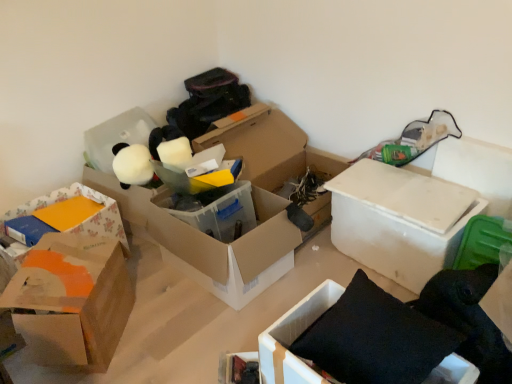
The height and width of the screenshot is (384, 512). Find the location of `white cardboard box at center-right, the fifth box when ordered from left to right`. white cardboard box at center-right, the fifth box when ordered from left to right is located at coordinates (399, 220).

Measure the distance between point (120,139) and camera.

Point (120,139) and camera are 2.33 meters apart from each other.

Image resolution: width=512 pixels, height=384 pixels. Find the location of `orange cardboard box at left, the second box in the left-to-right sequence`. orange cardboard box at left, the second box in the left-to-right sequence is located at coordinates (71, 300).

Image resolution: width=512 pixels, height=384 pixels. I want to click on white cardboard box at center-right, the first box in the right-to-left sequence, so click(x=399, y=220).

From the image's perspective, which is below, translucent plastic box at center, placed as the third box when sorted from left to right, or matte black book at lower center, the first storage box ordered from the bottom?

matte black book at lower center, the first storage box ordered from the bottom, from the image's perspective.

Is point (208, 245) farther from viewer compared to point (224, 371)?

Yes, it is behind point (224, 371).

Can you confirm if translucent plastic box at center, placed as the 3th box when sorted from right to left, is bigger than matte black book at lower center, the 2th storage box from the top?

Indeed, translucent plastic box at center, placed as the 3th box when sorted from right to left, has a larger size compared to matte black book at lower center, the 2th storage box from the top.

Is matte black book at lower center, arranged as the second storage box when viewed from the left, located within translucent plastic box at center, placed as the 3th box when sorted from right to left?

No, matte black book at lower center, arranged as the second storage box when viewed from the left, is not inside translucent plastic box at center, placed as the 3th box when sorted from right to left.

Considering the sizes of objects floral paper box at left, which is the first box in left-to-right order, and white cardboard box at center-right, the first box in the right-to-left sequence, in the image provided, who is shorter, floral paper box at left, which is the first box in left-to-right order, or white cardboard box at center-right, the first box in the right-to-left sequence,?

With less height is floral paper box at left, which is the first box in left-to-right order.

Is floral paper box at left, which is the first box in left-to-right order, looking in the opposite direction of white cardboard box at center-right, the first box in the right-to-left sequence?

floral paper box at left, which is the first box in left-to-right order, does not have its back to white cardboard box at center-right, the first box in the right-to-left sequence.

Which object is further away from the camera taking this photo, floral paper box at left, which is the first box in left-to-right order, or white cardboard box at center-right, the fifth box when ordered from left to right?

floral paper box at left, which is the first box in left-to-right order.

From a real-world perspective, between floral paper box at left, marked as the 5th box in a right-to-left arrangement, and white cardboard box at center-right, the fifth box when ordered from left to right, who is vertically higher?

In real-world perspective, floral paper box at left, marked as the 5th box in a right-to-left arrangement, is above.

In the image, is white matte stuffed animal at upper left, the 1th storage box viewed from the top, on the left side or the right side of orange cardboard box at left, the second box in the left-to-right sequence?

Clearly, white matte stuffed animal at upper left, the 1th storage box viewed from the top, is on the left of orange cardboard box at left, the second box in the left-to-right sequence, in the image.

The height and width of the screenshot is (384, 512). In order to click on storage box above the orange cardboard box at left, which appears as the 4th box when viewed from the right (from a real-world perspective) in this screenshot , I will do `click(116, 137)`.

From the image's perspective, who appears lower, white matte stuffed animal at upper left, arranged as the 2th storage box when viewed from the right, or orange cardboard box at left, the second box in the left-to-right sequence?

orange cardboard box at left, the second box in the left-to-right sequence, is shown below in the image.

In the scene shown: Is white matte stuffed animal at upper left, the 1th storage box viewed from the top, next to orange cardboard box at left, which appears as the 4th box when viewed from the right, and touching it?

No, white matte stuffed animal at upper left, the 1th storage box viewed from the top, is not touching orange cardboard box at left, which appears as the 4th box when viewed from the right.

Consider the image. Are orange cardboard box at left, which appears as the 4th box when viewed from the right, and floral paper box at left, which is the first box in left-to-right order, making contact?

They are not placed beside each other.

Looking at this image, is orange cardboard box at left, which appears as the 4th box when viewed from the right, taller or shorter than floral paper box at left, marked as the 5th box in a right-to-left arrangement?

Clearly, orange cardboard box at left, which appears as the 4th box when viewed from the right, is taller compared to floral paper box at left, marked as the 5th box in a right-to-left arrangement.

From the picture: Can you confirm if orange cardboard box at left, the second box in the left-to-right sequence, is positioned to the right of floral paper box at left, which is the first box in left-to-right order?

Correct, you'll find orange cardboard box at left, the second box in the left-to-right sequence, to the right of floral paper box at left, which is the first box in left-to-right order.

How different are the orientations of orange cardboard box at left, which appears as the 4th box when viewed from the right, and floral paper box at left, marked as the 5th box in a right-to-left arrangement, in degrees?

The facing directions of orange cardboard box at left, which appears as the 4th box when viewed from the right, and floral paper box at left, marked as the 5th box in a right-to-left arrangement, are 34.3 degrees apart.

From a real-world perspective, is matte black book at lower center, the first storage box ordered from the bottom, above or below white cardboard box at center-right, the fifth box when ordered from left to right?

From a real-world perspective, matte black book at lower center, the first storage box ordered from the bottom, is physically below white cardboard box at center-right, the fifth box when ordered from left to right.

Is matte black book at lower center, the first storage box ordered from the bottom, placed right next to white cardboard box at center-right, the first box in the right-to-left sequence?

There is a gap between matte black book at lower center, the first storage box ordered from the bottom, and white cardboard box at center-right, the first box in the right-to-left sequence.

Which object is positioned more to the right, matte black book at lower center, the 2th storage box from the top, or white cardboard box at center-right, the fifth box when ordered from left to right?

Positioned to the right is white cardboard box at center-right, the fifth box when ordered from left to right.

What's the angular difference between matte black book at lower center, which ranks as the first storage box in right-to-left order, and white cardboard box at center-right, the fifth box when ordered from left to right,'s facing directions?

They differ by 45.1 degrees in their facing directions.

Can you confirm if white cardboard box at center-right, the fifth box when ordered from left to right, is positioned to the left of floral paper box at left, which is the first box in left-to-right order?

No.

From the image's perspective, is white cardboard box at center-right, the first box in the right-to-left sequence, located beneath floral paper box at left, marked as the 5th box in a right-to-left arrangement?

Actually, white cardboard box at center-right, the first box in the right-to-left sequence, appears above floral paper box at left, marked as the 5th box in a right-to-left arrangement, in the image.

Looking at this image, is the surface of white cardboard box at center-right, the first box in the right-to-left sequence, in direct contact with floral paper box at left, which is the first box in left-to-right order?

white cardboard box at center-right, the first box in the right-to-left sequence, and floral paper box at left, which is the first box in left-to-right order, are clearly separated.

Based on their sizes in the image, would you say orange cardboard box at left, which appears as the 4th box when viewed from the right, is bigger or smaller than white cardboard box at center-right, the first box in the right-to-left sequence?

Clearly, orange cardboard box at left, which appears as the 4th box when viewed from the right, is smaller in size than white cardboard box at center-right, the first box in the right-to-left sequence.

Considering the positions of objects orange cardboard box at left, the second box in the left-to-right sequence, and white cardboard box at center-right, the first box in the right-to-left sequence, in the image provided, who is more to the right, orange cardboard box at left, the second box in the left-to-right sequence, or white cardboard box at center-right, the first box in the right-to-left sequence,?

Positioned to the right is white cardboard box at center-right, the first box in the right-to-left sequence.

Between point (54, 321) and point (347, 173), which one is positioned behind?

The point (347, 173) is more distant.

Is white cardboard box at center-right, the fifth box when ordered from left to right, at the back of orange cardboard box at left, which appears as the 4th box when viewed from the right?

orange cardboard box at left, which appears as the 4th box when viewed from the right, does not have its back to white cardboard box at center-right, the fifth box when ordered from left to right.

Locate an element on the screen. The image size is (512, 384). storage box lying in front of the translucent plastic box at center, placed as the 3th box when sorted from right to left is located at coordinates (239, 368).

This screenshot has width=512, height=384. In order to click on box above the white cardboard box at center-right, the first box in the right-to-left sequence (from a real-world perspective) in this screenshot , I will do `click(84, 220)`.

From the picture: Based on their spatial positions, is white cardboard box at center-right, the first box in the right-to-left sequence, or translucent plastic box at center, placed as the third box when sorted from left to right, closer to black fabric cushion at lower right, placed as the fourth box when sorted from left to right?

white cardboard box at center-right, the first box in the right-to-left sequence, is positioned closer to the anchor black fabric cushion at lower right, placed as the fourth box when sorted from left to right.

Looking at the image, which one is located closer to black fabric cushion at lower right, the second box positioned from the right, matte black book at lower center, arranged as the second storage box when viewed from the left, or white matte stuffed animal at upper left, the second storage box when ordered from bottom to top?

Based on the image, matte black book at lower center, arranged as the second storage box when viewed from the left, appears to be nearer to black fabric cushion at lower right, the second box positioned from the right.

Considering their positions, is black fabric cushion at lower right, the second box positioned from the right, positioned closer to translucent plastic box at center, placed as the 3th box when sorted from right to left, than matte black book at lower center, the second storage box from the back?

Among the two, matte black book at lower center, the second storage box from the back, is located nearer to translucent plastic box at center, placed as the 3th box when sorted from right to left.

Based on their spatial positions, is white cardboard box at center-right, the fifth box when ordered from left to right, or floral paper box at left, marked as the 5th box in a right-to-left arrangement, further from matte black book at lower center, the first storage box ordered from the bottom?

floral paper box at left, marked as the 5th box in a right-to-left arrangement, is positioned further to the anchor matte black book at lower center, the first storage box ordered from the bottom.

Consider the image. Which object lies nearer to the anchor point white cardboard box at center-right, the fifth box when ordered from left to right, orange cardboard box at left, the second box in the left-to-right sequence, or floral paper box at left, marked as the 5th box in a right-to-left arrangement?

Based on the image, orange cardboard box at left, the second box in the left-to-right sequence, appears to be nearer to white cardboard box at center-right, the fifth box when ordered from left to right.

From the image, which object appears to be nearer to white cardboard box at center-right, the fifth box when ordered from left to right, translucent plastic box at center, placed as the third box when sorted from left to right, or black fabric cushion at lower right, placed as the fourth box when sorted from left to right?

Among the two, translucent plastic box at center, placed as the third box when sorted from left to right, is located nearer to white cardboard box at center-right, the fifth box when ordered from left to right.

When comparing their distances from white matte stuffed animal at upper left, arranged as the 2th storage box when viewed from the right, does matte black book at lower center, the first storage box ordered from the bottom, or orange cardboard box at left, the second box in the left-to-right sequence, seem further?

matte black book at lower center, the first storage box ordered from the bottom, is positioned further to the anchor white matte stuffed animal at upper left, arranged as the 2th storage box when viewed from the right.

Which object lies nearer to the anchor point white cardboard box at center-right, the fifth box when ordered from left to right, floral paper box at left, marked as the 5th box in a right-to-left arrangement, or black fabric cushion at lower right, placed as the fourth box when sorted from left to right?

Based on the image, black fabric cushion at lower right, placed as the fourth box when sorted from left to right, appears to be nearer to white cardboard box at center-right, the fifth box when ordered from left to right.

Where is `storage box between translucent plastic box at center, placed as the 3th box when sorted from right to left, and white cardboard box at center-right, the first box in the right-to-left sequence, from left to right`? This screenshot has width=512, height=384. storage box between translucent plastic box at center, placed as the 3th box when sorted from right to left, and white cardboard box at center-right, the first box in the right-to-left sequence, from left to right is located at coordinates (239, 368).

Locate an element on the screen. box between orange cardboard box at left, the second box in the left-to-right sequence, and black fabric cushion at lower right, placed as the fourth box when sorted from left to right is located at coordinates (211, 241).

Locate an element on the screen. This screenshot has height=384, width=512. storage box situated between orange cardboard box at left, the second box in the left-to-right sequence, and black fabric cushion at lower right, placed as the fourth box when sorted from left to right, from left to right is located at coordinates (239, 368).

This screenshot has height=384, width=512. Find the location of `box between floral paper box at left, which is the first box in left-to-right order, and translucent plastic box at center, placed as the third box when sorted from left to right, from left to right`. box between floral paper box at left, which is the first box in left-to-right order, and translucent plastic box at center, placed as the third box when sorted from left to right, from left to right is located at coordinates (71, 300).